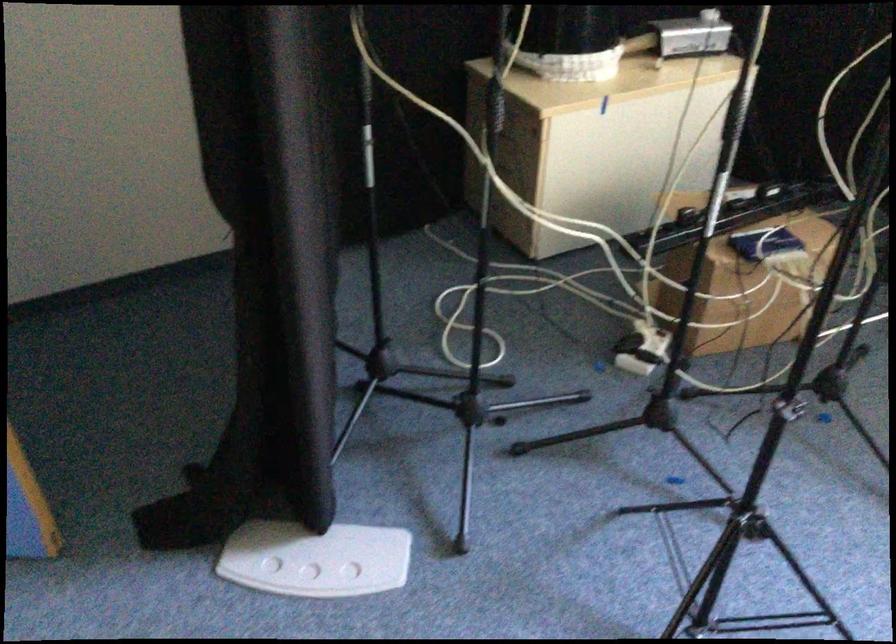
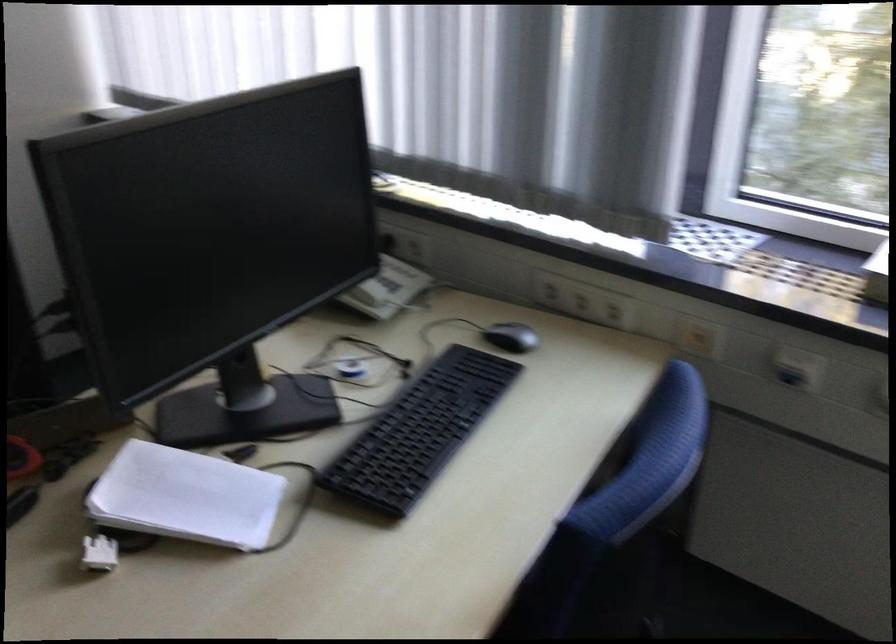
Question: The images are taken continuously from a first-person perspective. In which direction are you moving?

Choices:
 (A) Left
 (B) Right
 (C) Forward
 (D) Backward

Answer: (B)